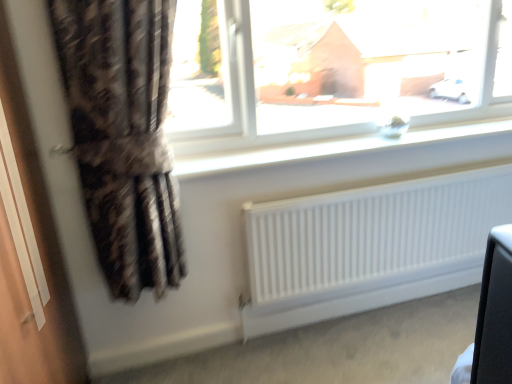
Locate an element on the screen. This screenshot has width=512, height=384. vacant region below white matte radiator at lower center (from a real-world perspective) is located at coordinates click(x=395, y=312).